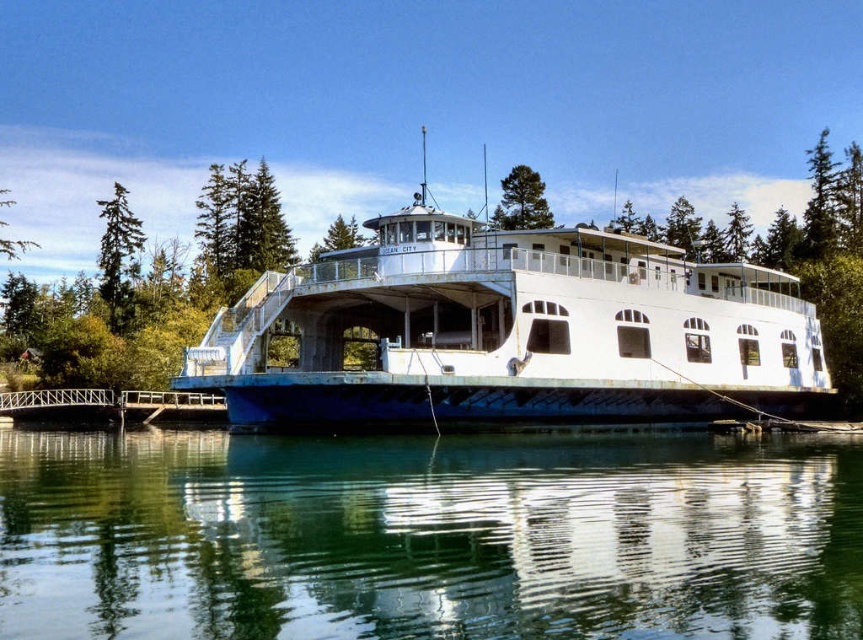
Question: Among these objects, which one is nearest to the camera?

Choices:
 (A) metallic gray dock at lower left
 (B) green matte tree at upper left
 (C) green leafy tree at upper left

Answer: (A)

Question: Which of the following is the closest to the observer?

Choices:
 (A) (842, 612)
 (B) (10, 416)

Answer: (A)

Question: Can you confirm if metallic gray dock at lower left is positioned above green textured tree at upper center?

Choices:
 (A) yes
 (B) no

Answer: (B)

Question: From the image, what is the correct spatial relationship of metallic gray dock at lower left in relation to green matte tree at upper left?

Choices:
 (A) above
 (B) below

Answer: (B)

Question: Estimate the real-world distances between objects in this image. Which object is closer to the green matte tree at upper left?

Choices:
 (A) clear glass water at center
 (B) green leafy tree at upper left
 (C) metallic gray dock at lower left

Answer: (B)

Question: From the image, what is the correct spatial relationship of white matte boat at center in relation to green textured tree at upper center?

Choices:
 (A) right
 (B) left

Answer: (B)